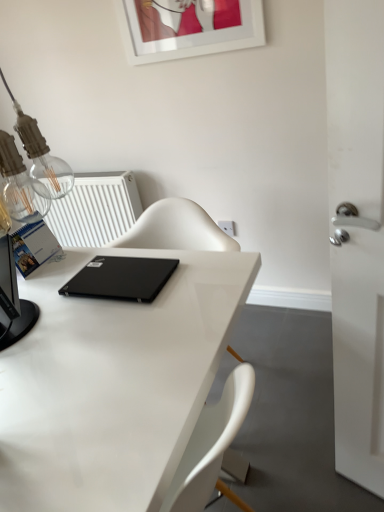
Question: From a real-world perspective, is white glossy picture frame at upper center over black matte laptop at center?

Choices:
 (A) no
 (B) yes

Answer: (B)

Question: Does white glossy picture frame at upper center have a greater width compared to black matte laptop at center?

Choices:
 (A) yes
 (B) no

Answer: (B)

Question: Is black matte laptop at center located within white glossy picture frame at upper center?

Choices:
 (A) yes
 (B) no

Answer: (B)

Question: Is white glossy picture frame at upper center looking in the opposite direction of black matte laptop at center?

Choices:
 (A) yes
 (B) no

Answer: (B)

Question: Can you confirm if white glossy picture frame at upper center is thinner than black matte laptop at center?

Choices:
 (A) no
 (B) yes

Answer: (B)

Question: Considering the relative positions of white glossy picture frame at upper center and black matte laptop at center in the image provided, is white glossy picture frame at upper center in front of black matte laptop at center?

Choices:
 (A) no
 (B) yes

Answer: (A)

Question: From a real-world perspective, is white glossy picture frame at upper center positioned over white glossy desk at center based on gravity?

Choices:
 (A) yes
 (B) no

Answer: (A)

Question: Considering the relative sizes of white glossy picture frame at upper center and white glossy desk at center in the image provided, is white glossy picture frame at upper center thinner than white glossy desk at center?

Choices:
 (A) no
 (B) yes

Answer: (B)

Question: Is white glossy picture frame at upper center at the right side of white glossy desk at center?

Choices:
 (A) no
 (B) yes

Answer: (B)

Question: Would you say white glossy picture frame at upper center is a long distance from white glossy desk at center?

Choices:
 (A) yes
 (B) no

Answer: (A)

Question: Is white glossy picture frame at upper center closer to the viewer compared to white glossy desk at center?

Choices:
 (A) no
 (B) yes

Answer: (A)

Question: Could you tell me if white glossy picture frame at upper center is turned towards white glossy desk at center?

Choices:
 (A) no
 (B) yes

Answer: (A)

Question: Is white plastic electric outlet at upper center smaller than white plastic radiator at upper left?

Choices:
 (A) yes
 (B) no

Answer: (A)